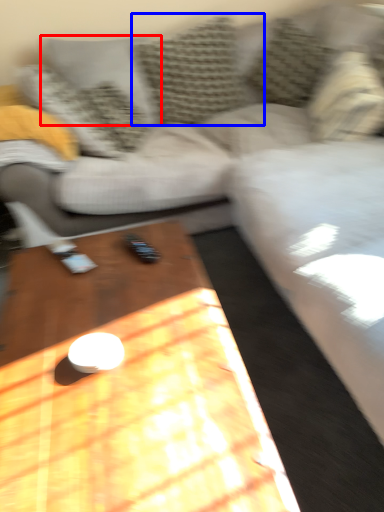
Question: Among these objects, which one is nearest to the camera, pillow (highlighted by a red box) or pillow (highlighted by a blue box)?

Choices:
 (A) pillow
 (B) pillow

Answer: (B)